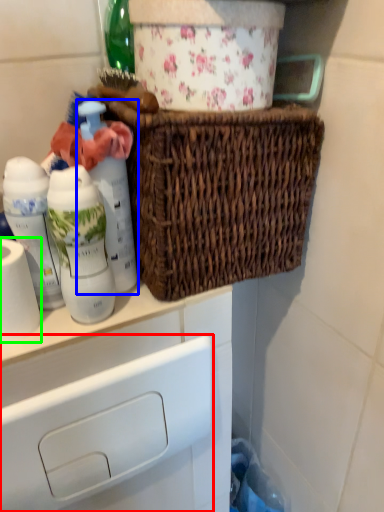
Question: Which is nearer to the drawer (highlighted by a red box)? bottle (highlighted by a blue box) or toilet paper (highlighted by a green box).

Choices:
 (A) bottle
 (B) toilet paper

Answer: (B)